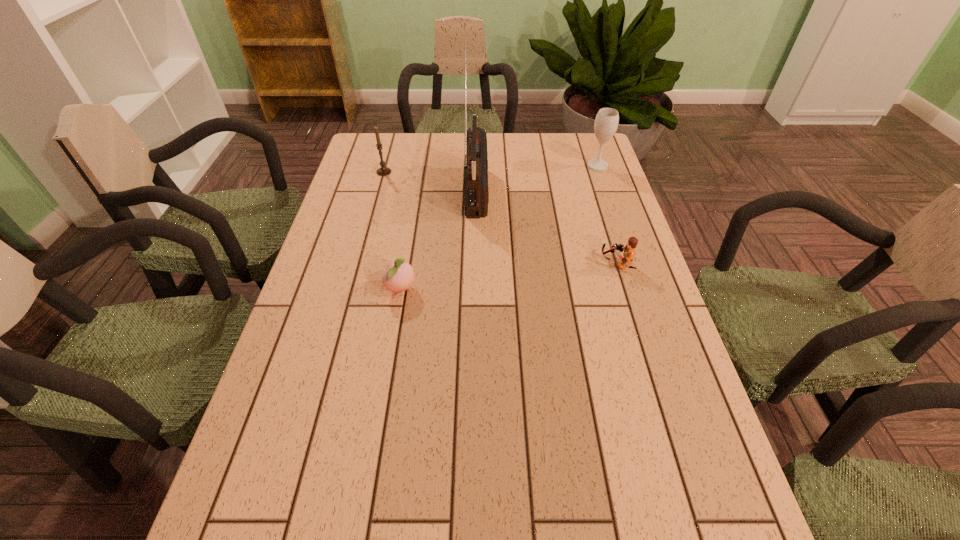
Locate an element on the screen. The width and height of the screenshot is (960, 540). vacant area that lies between the peach and the fourth farthest object is located at coordinates (509, 276).

Locate an element on the screen. This screenshot has width=960, height=540. free space between the radio receiver and the wineglass is located at coordinates (537, 177).

Image resolution: width=960 pixels, height=540 pixels. I want to click on object that can be found as the closest to the radio receiver, so click(383, 171).

Choose which object is the nearest neighbor to the nearest object. Please provide its 2D coordinates. Your answer should be formatted as a tuple, i.e. [(x, y)], where the tuple contains the x and y coordinates of a point satisfying the conditions above.

[(476, 194)]

The image size is (960, 540). Identify the location of vacant area in the image that satisfies the following two spatial constraints: 1. on the back side of the wineglass; 2. on the left side of the nearest object. (421, 166).

This screenshot has height=540, width=960. In order to click on vacant region that satisfies the following two spatial constraints: 1. holding a crossbow in the hands of the Lego; 2. on the front side of the nearest object in this screenshot , I will do `click(624, 289)`.